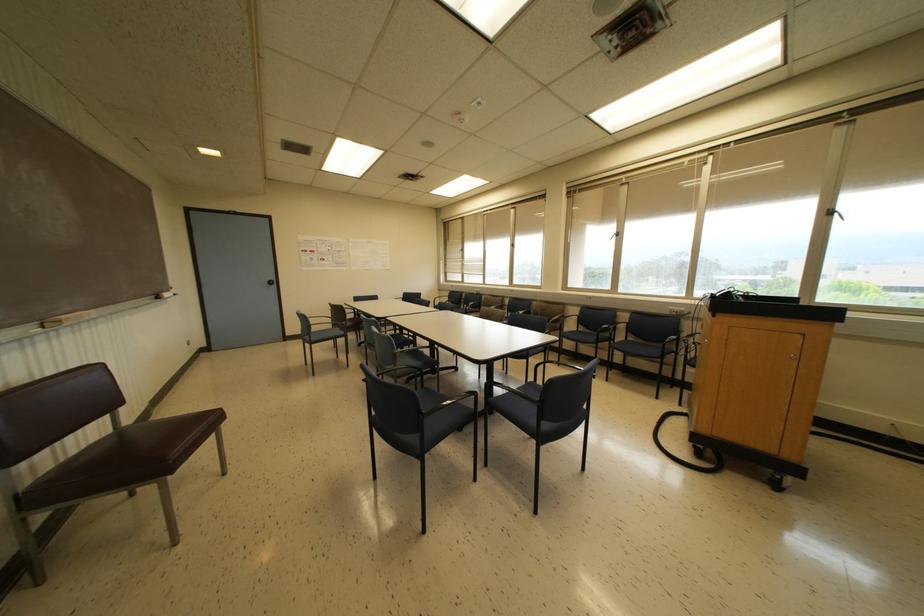
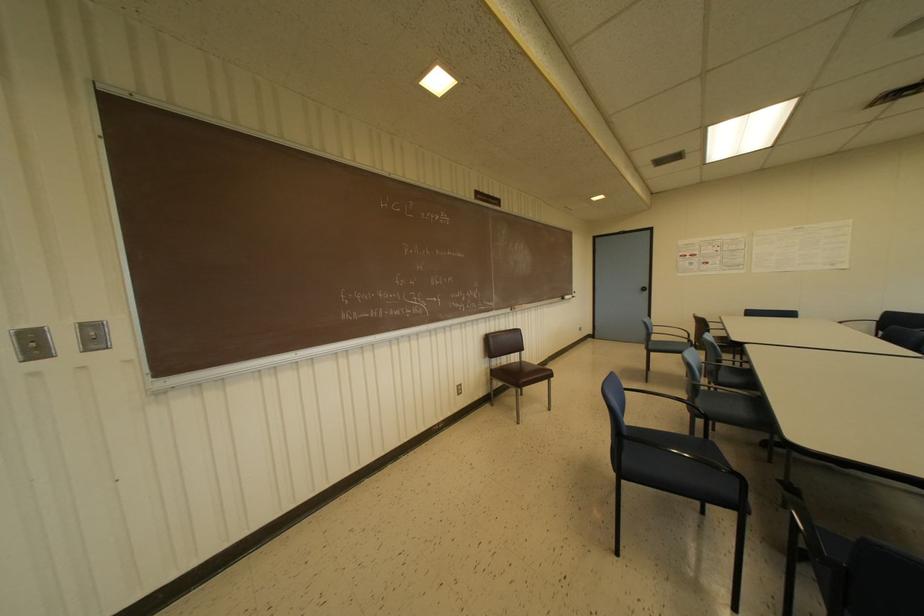
The point at (274, 282) is marked in the first image. Where is the corresponding point in the second image?

(646, 288)